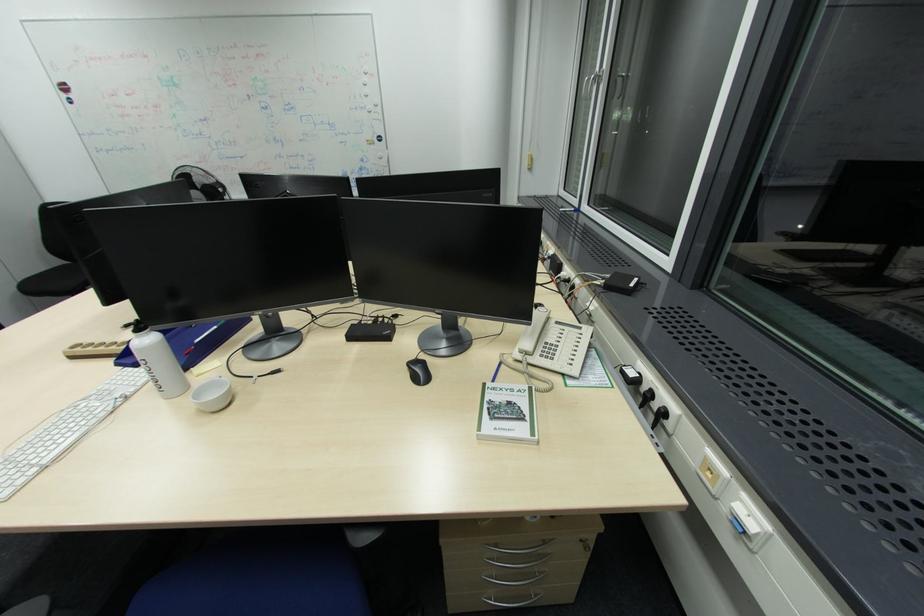
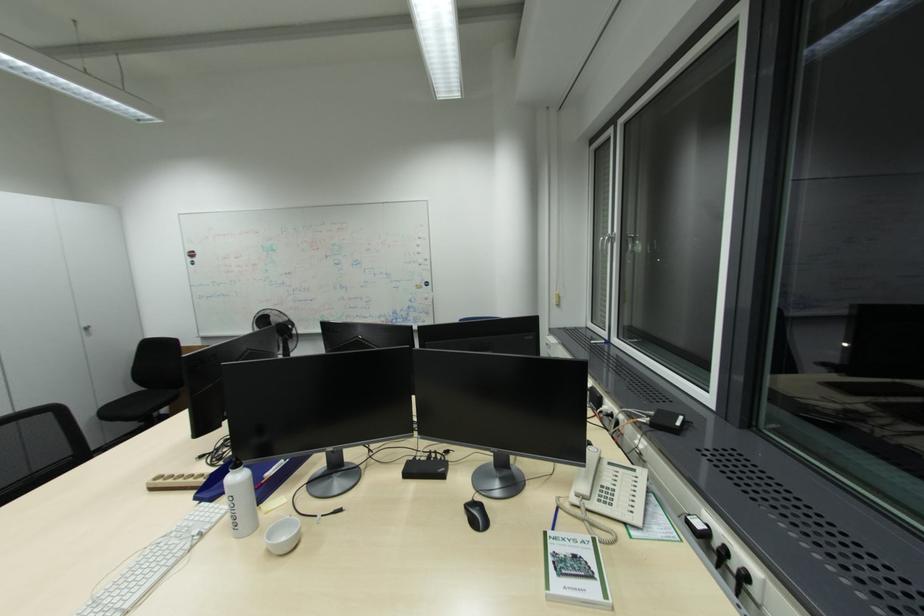
Which direction would the cameraman need to move to produce the second image?

The cameraman walked toward left, backward.